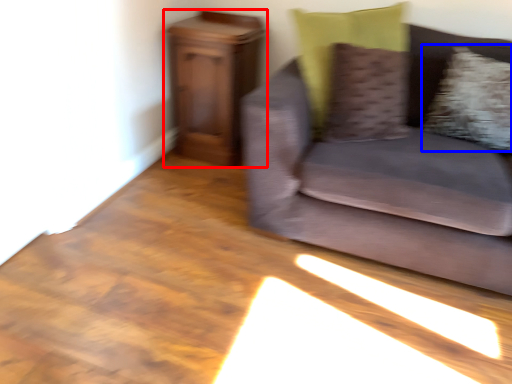
Question: Which point is closer to the camera, furniture (highlighted by a red box) or pillow (highlighted by a blue box)?

Choices:
 (A) furniture
 (B) pillow

Answer: (B)